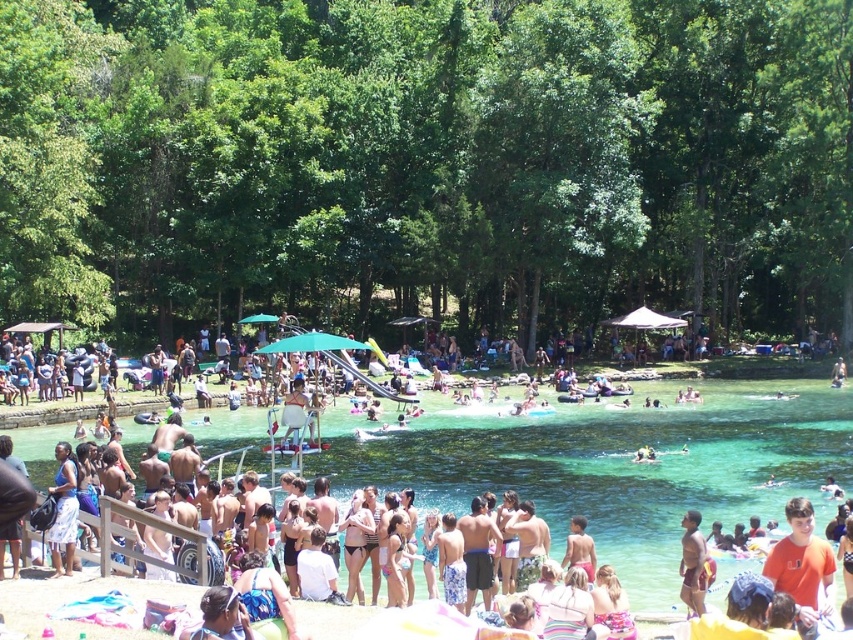
You are a swimmer who wants to avoid rough water. You see the point at coordinates (x=618, y=467) in the image. Is the water at that point safe to swim in?

The point at coordinates (x=618, y=467) is on clear water at center, so yes, the water at that point is safe to swim in.

You are a photographer trying to capture a wide shot of the clear water at center and the tan skin human at lower right. Which object in the scene is larger in the image?

The clear water at center is bigger than the tan skin human at lower right, so the clear water at center appears larger in the image.

You are a swimmer who wants to enter the water safely. You see the clear water at center and the tan skin human at lower right. Which object is closer to you, and why?

The tan skin human at lower right is closer to you because they are positioned behind the clear water at center, meaning the water is between you and the human.